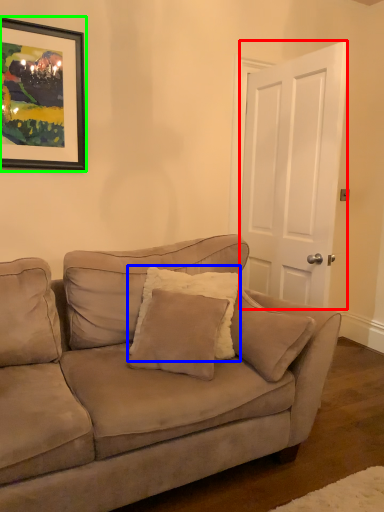
Question: Estimate the real-world distances between objects in this image. Which object is closer to door (highlighted by a red box), pillow (highlighted by a blue box) or picture frame (highlighted by a green box)?

Choices:
 (A) pillow
 (B) picture frame

Answer: (A)